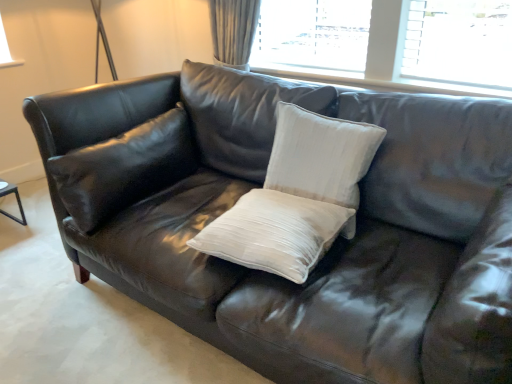
Question: In terms of size, does white textured pillow at center, which ranks as the 3th pillow in left-to-right order, appear bigger or smaller than matte black pillow at left, placed as the 3th pillow when sorted from right to left?

Choices:
 (A) small
 (B) big

Answer: (A)

Question: Considering their positions, is white textured pillow at center, which ranks as the 3th pillow in left-to-right order, located in front of or behind matte black pillow at left, positioned as the first pillow in left-to-right order?

Choices:
 (A) behind
 (B) front

Answer: (B)

Question: Based on their relative distances, which object is farther from the white satin pillow at center, the 2th pillow positioned from the right?

Choices:
 (A) matte black pillow at left, positioned as the first pillow in left-to-right order
 (B) white textured pillow at center, the 1th pillow positioned from the right

Answer: (A)

Question: Which of these objects is positioned farthest from the white satin pillow at center, the second pillow from the left?

Choices:
 (A) matte black pillow at left, positioned as the first pillow in left-to-right order
 (B) white textured pillow at center, which ranks as the 3th pillow in left-to-right order

Answer: (A)